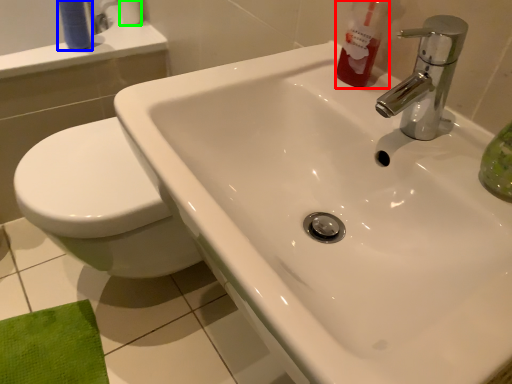
Question: Estimate the real-world distances between objects in this image. Which object is closer to cleaning product (highlighted by a red box), toiletry (highlighted by a blue box) or toilet paper (highlighted by a green box)?

Choices:
 (A) toiletry
 (B) toilet paper

Answer: (A)